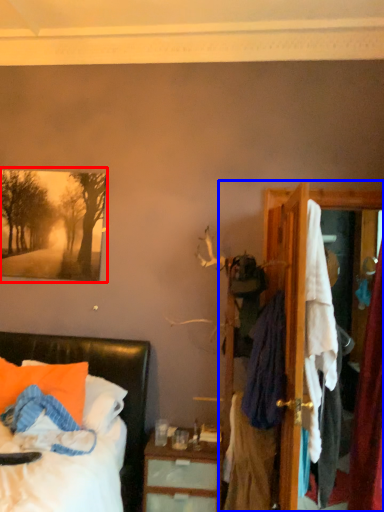
Question: Which of the following is the closest to the observer, picture frame (highlighted by a red box) or dresser (highlighted by a blue box)?

Choices:
 (A) picture frame
 (B) dresser

Answer: (B)